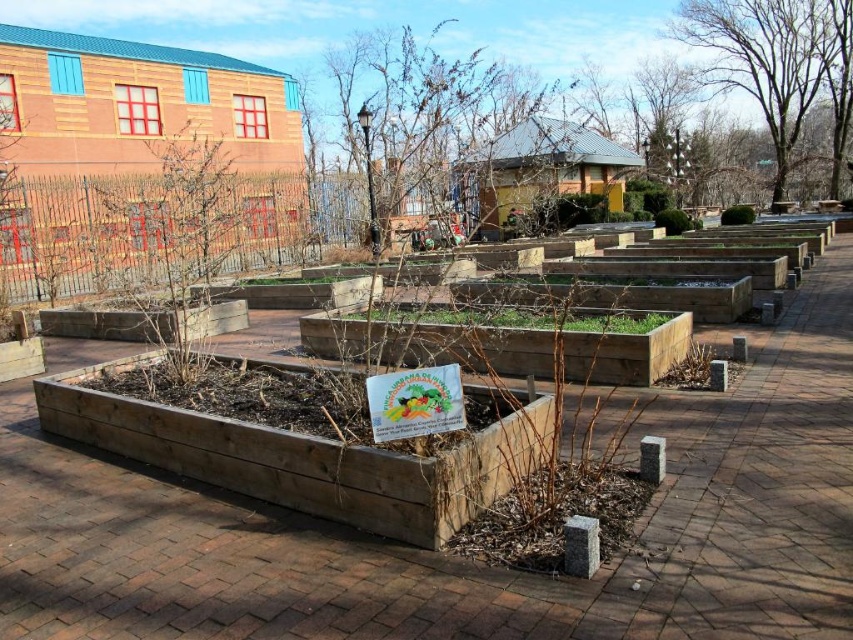
Does natural wood planter at center appear on the left side of bare branches at upper right?

Correct, you'll find natural wood planter at center to the left of bare branches at upper right.

Can you confirm if natural wood planter at center is thinner than bare branches at upper right?

Indeed, natural wood planter at center has a lesser width compared to bare branches at upper right.

Is point (526, 412) in front of point (776, 93)?

That is True.

I want to click on natural wood planter at center, so click(x=305, y=458).

Is point (416, 326) closer to viewer compared to point (769, 22)?

Yes, it is in front of point (769, 22).

Can you confirm if brown wooden flower bed at center is positioned above bare branches at upper right?

No.

The height and width of the screenshot is (640, 853). I want to click on brown wooden flower bed at center, so click(x=502, y=346).

Image resolution: width=853 pixels, height=640 pixels. What are the coordinates of `brown wooden flower bed at center` in the screenshot? It's located at (502, 346).

Is natural wood planter at center to the left of brown wooden flower bed at center from the viewer's perspective?

Yes, natural wood planter at center is to the left of brown wooden flower bed at center.

Can you confirm if natural wood planter at center is thinner than brown wooden flower bed at center?

Incorrect, natural wood planter at center's width is not less than brown wooden flower bed at center's.

Is point (428, 477) less distant than point (396, 348)?

Yes, it is in front of point (396, 348).

You are a GUI agent. You are given a task and a screenshot of the screen. Output one action in this format:
    pyautogui.click(x=<x>, y=<y>)
    Task: Click on the natural wood planter at center
    The image size is (853, 640).
    Given the screenshot: What is the action you would take?
    pyautogui.click(x=305, y=458)